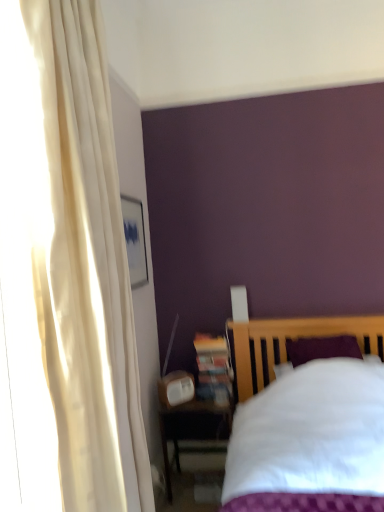
Question: Considering the relative sizes of white cotton bed at lower right and matte wooden nightstand at lower left in the image provided, is white cotton bed at lower right wider than matte wooden nightstand at lower left?

Choices:
 (A) yes
 (B) no

Answer: (A)

Question: Is matte wooden nightstand at lower left inside white cotton bed at lower right?

Choices:
 (A) yes
 (B) no

Answer: (B)

Question: Is white cotton bed at lower right not within matte wooden nightstand at lower left?

Choices:
 (A) no
 (B) yes

Answer: (B)

Question: Considering the relative positions of white cotton bed at lower right and matte wooden nightstand at lower left in the image provided, is white cotton bed at lower right to the left of matte wooden nightstand at lower left from the viewer's perspective?

Choices:
 (A) yes
 (B) no

Answer: (B)

Question: Is white cotton bed at lower right facing towards matte wooden nightstand at lower left?

Choices:
 (A) yes
 (B) no

Answer: (B)

Question: Does white cotton bed at lower right have a smaller size compared to matte wooden nightstand at lower left?

Choices:
 (A) yes
 (B) no

Answer: (B)

Question: Does wooden bookshelf at lower center have a lesser height compared to matte wooden nightstand at lower left?

Choices:
 (A) yes
 (B) no

Answer: (A)

Question: Can you confirm if wooden bookshelf at lower center is smaller than matte wooden nightstand at lower left?

Choices:
 (A) no
 (B) yes

Answer: (B)

Question: Is wooden bookshelf at lower center with matte wooden nightstand at lower left?

Choices:
 (A) no
 (B) yes

Answer: (A)

Question: Is wooden bookshelf at lower center looking in the opposite direction of matte wooden nightstand at lower left?

Choices:
 (A) no
 (B) yes

Answer: (A)

Question: Is wooden bookshelf at lower center not near matte wooden nightstand at lower left?

Choices:
 (A) no
 (B) yes

Answer: (A)

Question: Is wooden bookshelf at lower center facing towards matte wooden nightstand at lower left?

Choices:
 (A) yes
 (B) no

Answer: (B)

Question: From the image's perspective, is wooden bookshelf at lower center under white cotton bed at lower right?

Choices:
 (A) yes
 (B) no

Answer: (B)